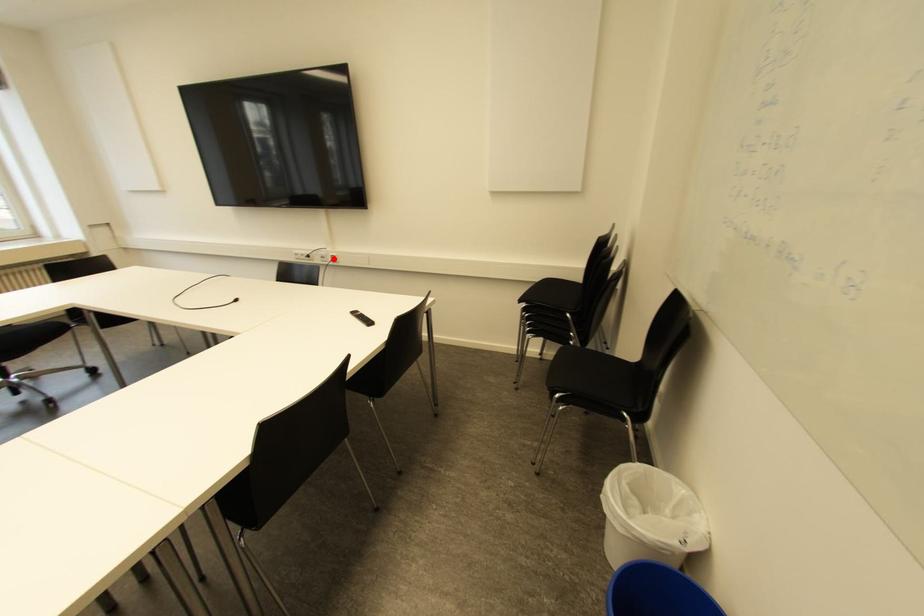
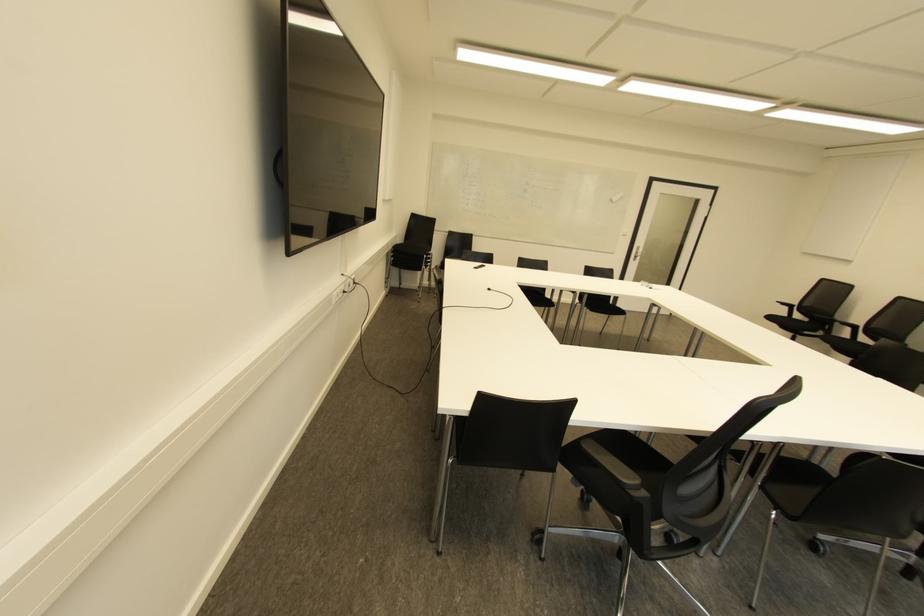
Locate, in the second image, the point that corresponds to the highlighted location in the first image.

(354, 282)